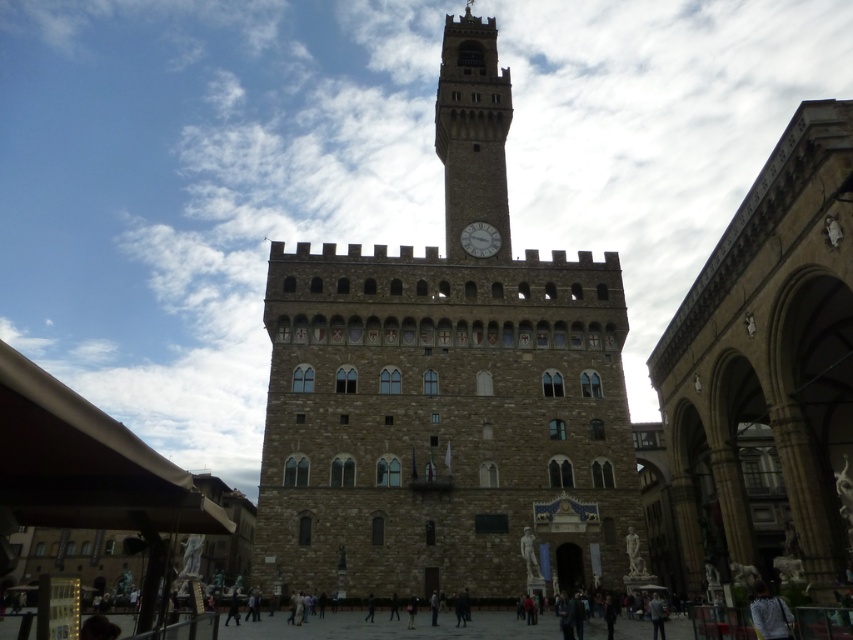
Find the location of a particular element. Image resolution: width=853 pixels, height=640 pixels. brown stone tower at center is located at coordinates (445, 392).

Can you confirm if brown stone tower at center is smaller than brown stone clock tower at upper center?

Incorrect, brown stone tower at center is not smaller in size than brown stone clock tower at upper center.

This screenshot has width=853, height=640. What are the coordinates of `brown stone tower at center` in the screenshot? It's located at (445, 392).

Does brown stone tower at center appear under white glossy clock at center?

No, brown stone tower at center is not below white glossy clock at center.

Locate an element on the screen. brown stone tower at center is located at coordinates (445, 392).

How distant is brown stone clock tower at upper center from white glossy clock at center?

brown stone clock tower at upper center is 8.61 meters from white glossy clock at center.

Which is more to the right, brown stone clock tower at upper center or white glossy clock at center?

white glossy clock at center is more to the right.

Measure the distance between brown stone clock tower at upper center and camera.

A distance of 74.49 meters exists between brown stone clock tower at upper center and camera.

At what (x,y) coordinates should I click in order to perform the action: click on brown stone clock tower at upper center. Please return your answer as a coordinate pair (x, y). The height and width of the screenshot is (640, 853). Looking at the image, I should click on (473, 132).